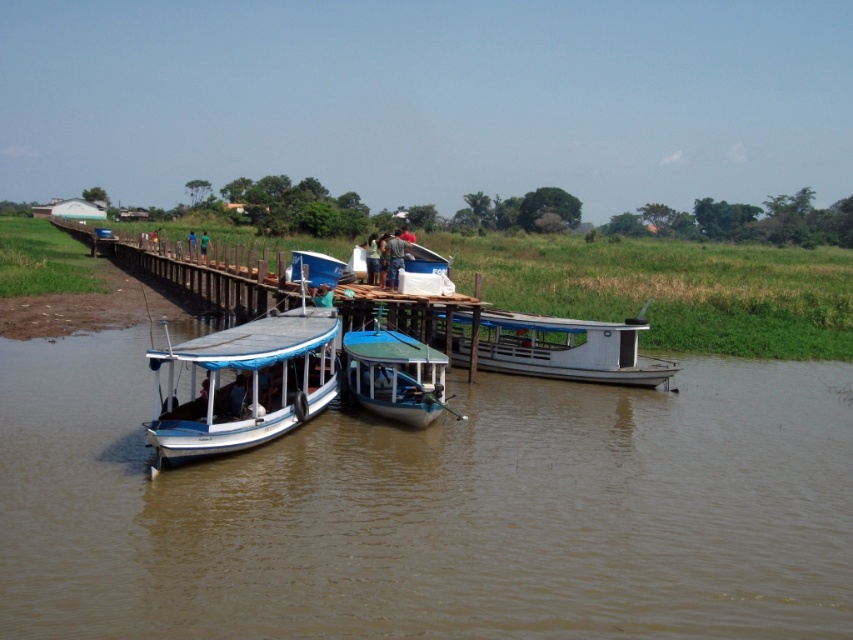
Question: Can you confirm if wooden dock at center is thinner than brown fabric bag at center?

Choices:
 (A) yes
 (B) no

Answer: (B)

Question: Which object is the closest to the wooden dock at center?

Choices:
 (A) brown fabric bag at center
 (B) white matte boat at center

Answer: (B)

Question: Which object appears farthest from the camera in this image?

Choices:
 (A) green fabric person at center
 (B) wooden dock at center
 (C) blue painted wood boat at lower left

Answer: (A)

Question: Can you confirm if brown muddy water at center is bigger than teal glossy boat at center?

Choices:
 (A) yes
 (B) no

Answer: (A)

Question: Which of the following is the farthest from the observer?

Choices:
 (A) blue painted wood boat at lower left
 (B) brown muddy water at center
 (C) brown fabric bag at center

Answer: (C)

Question: Is brown muddy water at center wider than blue painted wood boat at lower left?

Choices:
 (A) yes
 (B) no

Answer: (A)